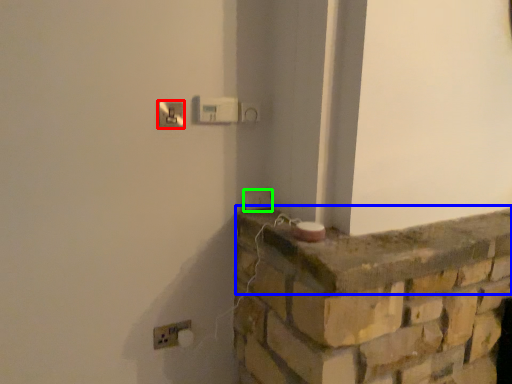
Question: Which is nearer to the light switch (highlighted by a red box)? ledge (highlighted by a blue box) or light switch (highlighted by a green box).

Choices:
 (A) ledge
 (B) light switch

Answer: (B)